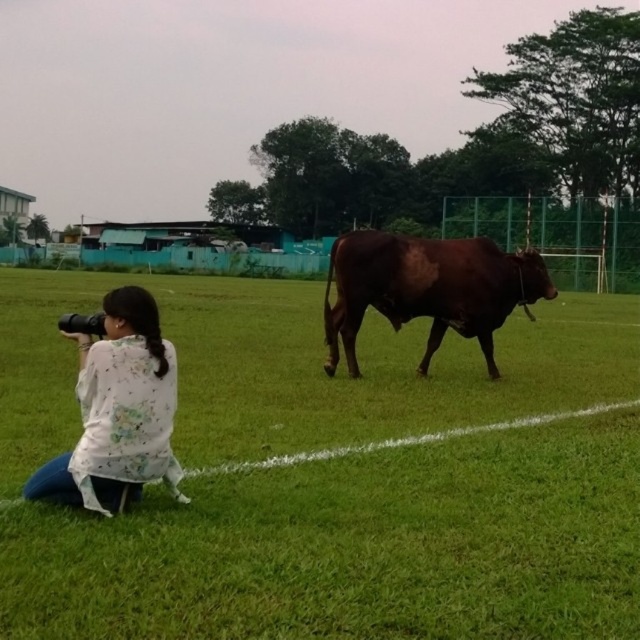
You are standing at the point labeled as point (378, 417) on the soccer field. If you want to take a photo of the cow walking towards the right, which direction should you turn to face the cow?

The cow is walking towards the right side of the frame, so you should turn to your right to face the cow.

You are the photographer crouched in the foreground of the soccer field. You want to take a photo of the cow in the midground. To do this, you need to adjust your camera so that both the cow and the cow are in focus. The cow is at point (106, 298), and the cow is at point (300, 401). Which point should you focus on to ensure both are in focus?

You should focus on point (300, 401) because it is behind point (106, 298), and focusing on the farther point will keep both in focus.

You are standing at the origin point of the coordinate system. You want to walk to the green grass at lower center. Which direction should you go?

The green grass at lower center is located at coordinate point (332, 476). Since the origin is at the bottom left corner of the image, moving towards the right and slightly upwards would lead you to the green grass at lower center.